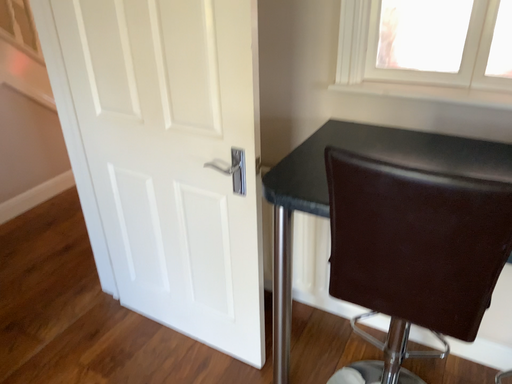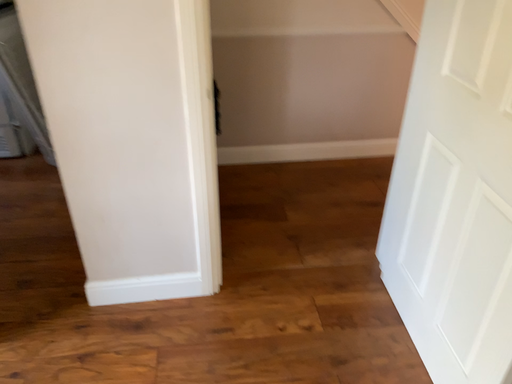
Question: Which way did the camera rotate in the video?

Choices:
 (A) rotated upward
 (B) rotated downward

Answer: (A)